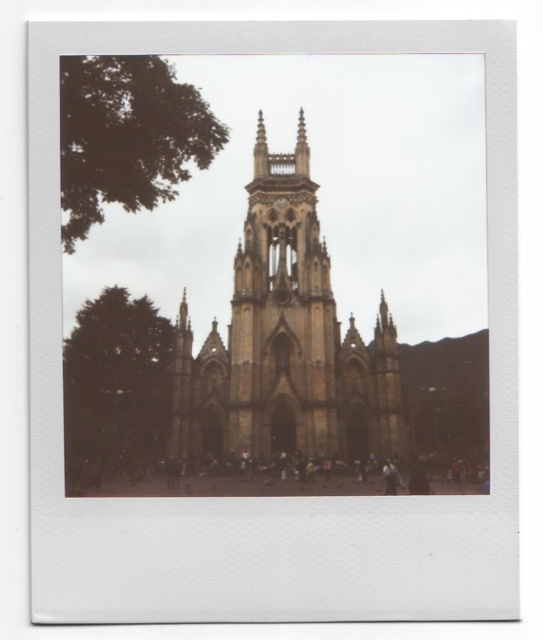
Question: Is the position of brown stone church at center less distant than that of green leafy tree at left?

Choices:
 (A) no
 (B) yes

Answer: (B)

Question: Among these points, which one is nearest to the camera?

Choices:
 (A) (395, 358)
 (B) (117, 460)

Answer: (A)

Question: Among these objects, which one is farthest from the camera?

Choices:
 (A) green leafy tree at upper left
 (B) light brown stone tower at center

Answer: (A)

Question: In this image, where is light brown stone tower at center located relative to green leafy tree at left?

Choices:
 (A) below
 (B) above

Answer: (B)

Question: Which point appears closest to the camera in this image?

Choices:
 (A) (179, 99)
 (B) (324, 342)
 (C) (388, 392)
 (D) (154, 419)

Answer: (C)

Question: Does light brown stone tower at center have a greater width compared to green leafy tree at left?

Choices:
 (A) yes
 (B) no

Answer: (B)